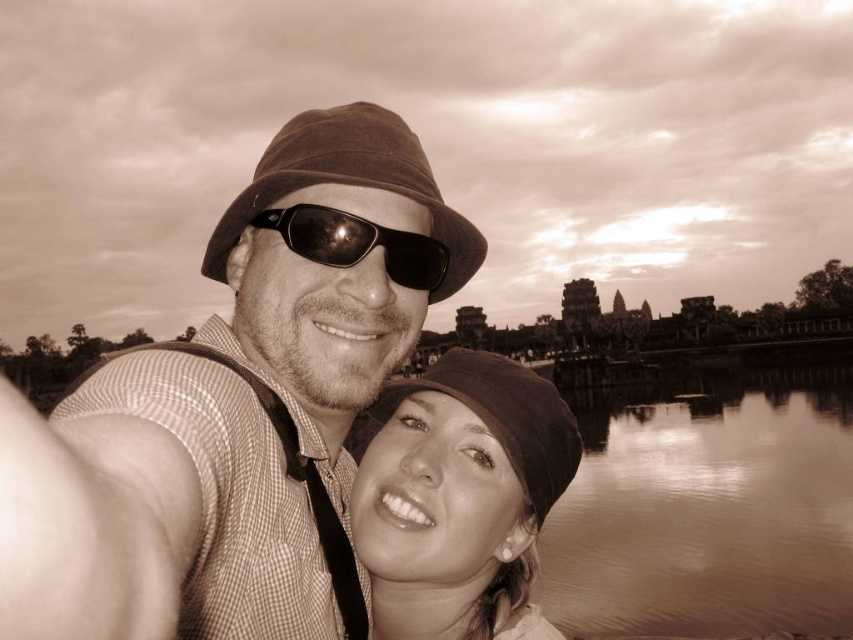
Is matte brown hat at center positioned before black reflective sunglasses at center?

Yes.

This screenshot has height=640, width=853. I want to click on matte brown hat at center, so click(x=236, y=410).

Identify the location of matte brown hat at center. This screenshot has width=853, height=640. (236, 410).

Based on the photo, is smooth water at lower right positioned at the back of black reflective sunglasses at center?

That is True.

Which is more to the right, smooth water at lower right or black reflective sunglasses at center?

Positioned to the right is smooth water at lower right.

Is point (618, 428) less distant than point (341, 228)?

That is False.

Locate an element on the screen. This screenshot has height=640, width=853. smooth water at lower right is located at coordinates (706, 508).

Is matte brown hat at center taller than smooth water at lower right?

Indeed, matte brown hat at center has a greater height compared to smooth water at lower right.

Who is higher up, matte brown hat at center or smooth water at lower right?

matte brown hat at center is higher up.

Between point (397, 230) and point (662, 452), which one is positioned behind?

Point (662, 452)

You are a GUI agent. You are given a task and a screenshot of the screen. Output one action in this format:
    pyautogui.click(x=<x>, y=<y>)
    Task: Click on the matte brown hat at center
    
    Given the screenshot: What is the action you would take?
    pyautogui.click(x=236, y=410)